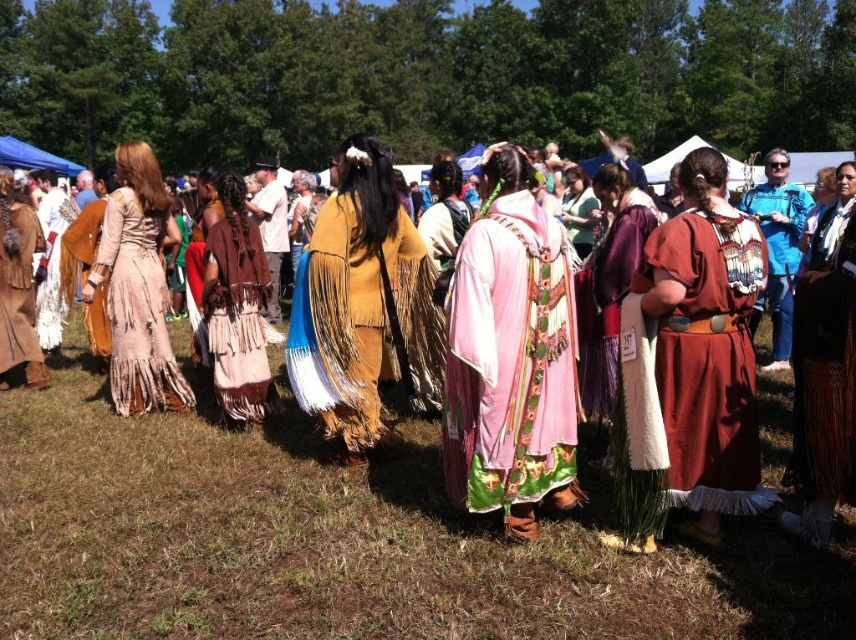
Question: Based on their relative distances, which object is farther from the matte brown leather dress at left?

Choices:
 (A) brown woven skirt at right
 (B) brown suede skirt at center
 (C) matte brown dress at left

Answer: (A)

Question: Is maroon suede skirt at center to the right of matte brown dress at left from the viewer's perspective?

Choices:
 (A) no
 (B) yes

Answer: (B)

Question: Is pastel pink fabric dress at center in front of matte yellow dress at center?

Choices:
 (A) no
 (B) yes

Answer: (B)

Question: Can you confirm if matte brown dress at center is positioned below blue denim jacket at upper right?

Choices:
 (A) yes
 (B) no

Answer: (A)

Question: Estimate the real-world distances between objects in this image. Which object is farther from the pastel pink fabric dress at center?

Choices:
 (A) matte yellow dress at center
 (B) matte brown leather dress at left
 (C) brown woven skirt at right

Answer: (B)

Question: Which object appears closest to the camera in this image?

Choices:
 (A) matte brown dress at center
 (B) pastel pink fabric dress at center

Answer: (B)